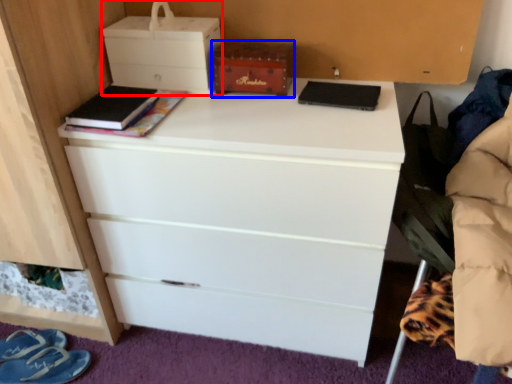
Question: Among these objects, which one is nearest to the camera, storage box (highlighted by a red box) or storage box (highlighted by a blue box)?

Choices:
 (A) storage box
 (B) storage box

Answer: (A)